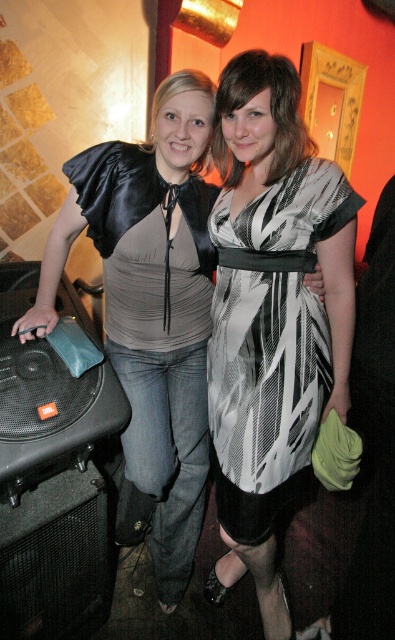
You are at a party and want to place a decorative item on top of the black plastic speaker at lower left. Can you place the black and white striped dress at center there without it falling off?

The black plastic speaker at lower left is taller than black and white striped dress at center, so placing the dress on top might be unstable because the speaker is taller than the dress. The dress might not have enough surface area to stay balanced.

You are at a party and want to take a photo with the black and white printed dress at center. Since the dress is at coordinates point 0.494, 0.689, where exactly should you position yourself to capture it in the frame?

The black and white printed dress at center is located at point [272,316], so you should position yourself directly facing that coordinate to ensure the dress is centered in your photo.

You are a photographer at a party and need to position the black and white printed dress at center and the black plastic speaker at lower left for a photo. Which object should you move to make space if you need to add a third item between them?

The black and white printed dress at center is thinner than the black plastic speaker at lower left, so you should move the dress to create more space between them for the third item.